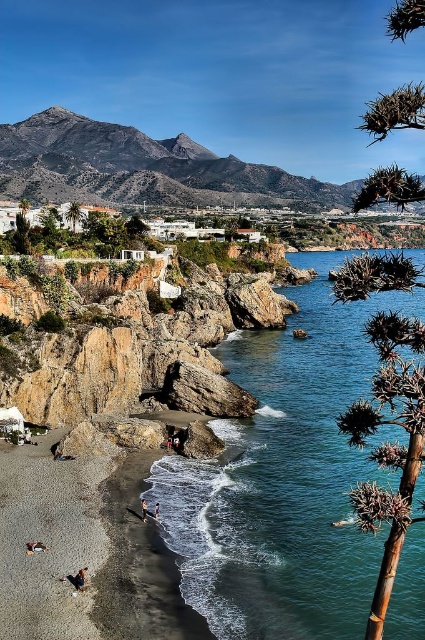
Measure the distance between green leafy tree at center and dark brown sand at lower left.

A distance of 120.55 meters exists between green leafy tree at center and dark brown sand at lower left.

Does green leafy tree at center lie behind dark brown sand at lower left?

Yes, green leafy tree at center is further from the viewer.

Between point (81, 212) and point (153, 513), which one is positioned behind?

Positioned behind is point (81, 212).

Find the location of a particular element. green leafy tree at center is located at coordinates (73, 214).

Which of these two, rugged brown rock formation at upper center or green spiky bush at upper right, stands shorter?

Standing shorter between the two is rugged brown rock formation at upper center.

Looking at this image, is rugged brown rock formation at upper center to the left of green spiky bush at upper right from the viewer's perspective?

Yes, rugged brown rock formation at upper center is to the left of green spiky bush at upper right.

Where is `rugged brown rock formation at upper center`? rugged brown rock formation at upper center is located at coordinates (141, 168).

Can you confirm if clear blue water at lower left is bigger than brown leather sandal at lower left?

Correct, clear blue water at lower left is larger in size than brown leather sandal at lower left.

In the scene shown: Who is higher up, clear blue water at lower left or brown leather sandal at lower left?

clear blue water at lower left

Is point (246, 428) closer to camera compared to point (78, 577)?

No, (246, 428) is further to viewer.

The image size is (425, 640). I want to click on clear blue water at lower left, so click(285, 477).